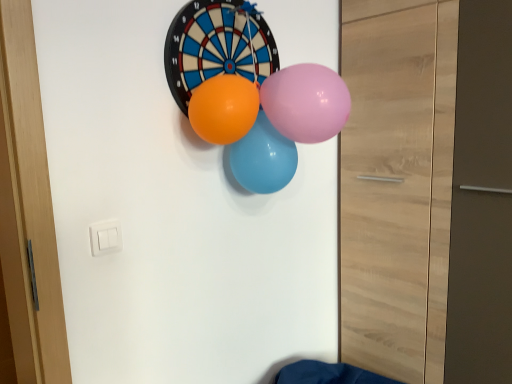
Measure the distance between matte blue balloon at center, which appears as the 1th balloon when viewed from the back, and camera.

The distance of matte blue balloon at center, which appears as the 1th balloon when viewed from the back, from camera is 1.15 meters.

What is the approximate width of matte blue balloon at center, which appears as the 1th balloon when viewed from the back?

The width of matte blue balloon at center, which appears as the 1th balloon when viewed from the back, is 4.50 inches.

The image size is (512, 384). I want to click on pink glossy balloon at center, the 1th balloon in the front-to-back sequence, so click(306, 102).

Which is correct: orange rubber balloon at center, which is counted as the second balloon, starting from the front, is inside matte blue balloon at center, acting as the 3th balloon starting from the front, or outside of it?

orange rubber balloon at center, which is counted as the second balloon, starting from the front, exists outside the volume of matte blue balloon at center, acting as the 3th balloon starting from the front.

Measure the distance from orange rubber balloon at center, the 2th balloon viewed from the back, to matte blue balloon at center, which appears as the 1th balloon when viewed from the back.

4.17 inches.

From the image's perspective, would you say orange rubber balloon at center, the 2th balloon viewed from the back, is shown under matte blue balloon at center, acting as the 3th balloon starting from the front?

No, from the image's perspective, orange rubber balloon at center, the 2th balloon viewed from the back, is not beneath matte blue balloon at center, acting as the 3th balloon starting from the front.

From a real-world perspective, is orange rubber balloon at center, which is counted as the second balloon, starting from the front, physically below matte blue balloon at center, which appears as the 1th balloon when viewed from the back?

Actually, orange rubber balloon at center, which is counted as the second balloon, starting from the front, is physically above matte blue balloon at center, which appears as the 1th balloon when viewed from the back, in the real world.

Does orange rubber balloon at center, the 2th balloon viewed from the back, have a lesser width compared to pink glossy balloon at center, the third balloon in the back-to-front sequence?

Correct, the width of orange rubber balloon at center, the 2th balloon viewed from the back, is less than that of pink glossy balloon at center, the third balloon in the back-to-front sequence.

What's the angular difference between orange rubber balloon at center, which is counted as the second balloon, starting from the front, and pink glossy balloon at center, the 1th balloon in the front-to-back sequence,'s facing directions?

They differ by 0.000176 degrees in their facing directions.

Is pink glossy balloon at center, the 1th balloon in the front-to-back sequence, turned away from matte blue balloon at center, acting as the 3th balloon starting from the front?

That's not correct — pink glossy balloon at center, the 1th balloon in the front-to-back sequence, is not looking away from matte blue balloon at center, acting as the 3th balloon starting from the front.

Considering the positions of objects pink glossy balloon at center, the third balloon in the back-to-front sequence, and matte blue balloon at center, which appears as the 1th balloon when viewed from the back, in the image provided, who is more to the left, pink glossy balloon at center, the third balloon in the back-to-front sequence, or matte blue balloon at center, which appears as the 1th balloon when viewed from the back,?

From the viewer's perspective, matte blue balloon at center, which appears as the 1th balloon when viewed from the back, appears more on the left side.

Measure the distance between pink glossy balloon at center, the third balloon in the back-to-front sequence, and matte blue balloon at center, acting as the 3th balloon starting from the front.

They are 4.69 inches apart.

Is point (317, 94) behind point (284, 145)?

No, (317, 94) is closer to viewer.

You are a GUI agent. You are given a task and a screenshot of the screen. Output one action in this format:
    pyautogui.click(x=<x>, y=<y>)
    Task: Click on the balloon that is the 2nd object located behind the pink glossy balloon at center, the third balloon in the back-to-front sequence
    Image resolution: width=512 pixels, height=384 pixels.
    Given the screenshot: What is the action you would take?
    pyautogui.click(x=263, y=158)

Considering the sizes of objects matte blue balloon at center, acting as the 3th balloon starting from the front, and pink glossy balloon at center, the third balloon in the back-to-front sequence, in the image provided, who is smaller, matte blue balloon at center, acting as the 3th balloon starting from the front, or pink glossy balloon at center, the third balloon in the back-to-front sequence,?

pink glossy balloon at center, the third balloon in the back-to-front sequence.

From a real-world perspective, between matte blue balloon at center, which appears as the 1th balloon when viewed from the back, and pink glossy balloon at center, the 1th balloon in the front-to-back sequence, who is vertically higher?

pink glossy balloon at center, the 1th balloon in the front-to-back sequence, is physically above.

Does point (274, 174) lie in front of point (247, 98)?

No, it is behind (247, 98).

From a real-world perspective, is matte blue balloon at center, acting as the 3th balloon starting from the front, beneath orange rubber balloon at center, the 2th balloon viewed from the back?

Yes, from a real-world perspective, matte blue balloon at center, acting as the 3th balloon starting from the front, is under orange rubber balloon at center, the 2th balloon viewed from the back.

Is the position of matte blue balloon at center, acting as the 3th balloon starting from the front, less distant than that of orange rubber balloon at center, which is counted as the second balloon, starting from the front?

No, matte blue balloon at center, acting as the 3th balloon starting from the front, is behind orange rubber balloon at center, which is counted as the second balloon, starting from the front.

Is matte blue balloon at center, which appears as the 1th balloon when viewed from the back, aimed at orange rubber balloon at center, the 2th balloon viewed from the back?

No, matte blue balloon at center, which appears as the 1th balloon when viewed from the back, is not oriented towards orange rubber balloon at center, the 2th balloon viewed from the back.

Can you tell me how much pink glossy balloon at center, the 1th balloon in the front-to-back sequence, and orange rubber balloon at center, the 2th balloon viewed from the back, differ in facing direction?

The angular difference between pink glossy balloon at center, the 1th balloon in the front-to-back sequence, and orange rubber balloon at center, the 2th balloon viewed from the back, is 0.000176 degrees.

Considering the relative positions of pink glossy balloon at center, the 1th balloon in the front-to-back sequence, and orange rubber balloon at center, the 2th balloon viewed from the back, in the image provided, is pink glossy balloon at center, the 1th balloon in the front-to-back sequence, to the left or to the right of orange rubber balloon at center, the 2th balloon viewed from the back,?

pink glossy balloon at center, the 1th balloon in the front-to-back sequence, is positioned on orange rubber balloon at center, the 2th balloon viewed from the back,'s right side.

Can you confirm if pink glossy balloon at center, the third balloon in the back-to-front sequence, is smaller than orange rubber balloon at center, which is counted as the second balloon, starting from the front?

No.

Which of these two, pink glossy balloon at center, the 1th balloon in the front-to-back sequence, or orange rubber balloon at center, the 2th balloon viewed from the back, is wider?

pink glossy balloon at center, the 1th balloon in the front-to-back sequence.

Identify the location of balloon located on the left of matte blue balloon at center, acting as the 3th balloon starting from the front. The height and width of the screenshot is (384, 512). (224, 108).

Where is `the 1st balloon behind the pink glossy balloon at center, the third balloon in the back-to-front sequence`? The width and height of the screenshot is (512, 384). the 1st balloon behind the pink glossy balloon at center, the third balloon in the back-to-front sequence is located at coordinates (224, 108).

Estimate the real-world distances between objects in this image. Which object is closer to matte blue balloon at center, which appears as the 1th balloon when viewed from the back, orange rubber balloon at center, which is counted as the second balloon, starting from the front, or pink glossy balloon at center, the 1th balloon in the front-to-back sequence?

orange rubber balloon at center, which is counted as the second balloon, starting from the front, lies closer to matte blue balloon at center, which appears as the 1th balloon when viewed from the back, than the other object.

Considering their positions, is matte blue balloon at center, acting as the 3th balloon starting from the front, positioned further to pink glossy balloon at center, the third balloon in the back-to-front sequence, than orange rubber balloon at center, which is counted as the second balloon, starting from the front?

orange rubber balloon at center, which is counted as the second balloon, starting from the front, is positioned further to the anchor pink glossy balloon at center, the third balloon in the back-to-front sequence.

From the image, which object appears to be farther from pink glossy balloon at center, the 1th balloon in the front-to-back sequence, orange rubber balloon at center, which is counted as the second balloon, starting from the front, or matte blue balloon at center, acting as the 3th balloon starting from the front?

Based on the image, orange rubber balloon at center, which is counted as the second balloon, starting from the front, appears to be further to pink glossy balloon at center, the 1th balloon in the front-to-back sequence.

Which object lies nearer to the anchor point matte blue balloon at center, which appears as the 1th balloon when viewed from the back, pink glossy balloon at center, the third balloon in the back-to-front sequence, or orange rubber balloon at center, which is counted as the second balloon, starting from the front?

Among the two, orange rubber balloon at center, which is counted as the second balloon, starting from the front, is located nearer to matte blue balloon at center, which appears as the 1th balloon when viewed from the back.

When comparing their distances from orange rubber balloon at center, the 2th balloon viewed from the back, does matte blue balloon at center, which appears as the 1th balloon when viewed from the back, or pink glossy balloon at center, the 1th balloon in the front-to-back sequence, seem further?

pink glossy balloon at center, the 1th balloon in the front-to-back sequence, is positioned further to the anchor orange rubber balloon at center, the 2th balloon viewed from the back.

Which object lies nearer to the anchor point orange rubber balloon at center, which is counted as the second balloon, starting from the front, pink glossy balloon at center, the third balloon in the back-to-front sequence, or matte blue balloon at center, which appears as the 1th balloon when viewed from the back?

matte blue balloon at center, which appears as the 1th balloon when viewed from the back, is positioned closer to the anchor orange rubber balloon at center, which is counted as the second balloon, starting from the front.

This screenshot has width=512, height=384. In order to click on balloon positioned between pink glossy balloon at center, the 1th balloon in the front-to-back sequence, and matte blue balloon at center, acting as the 3th balloon starting from the front, from near to far in this screenshot , I will do `click(224, 108)`.